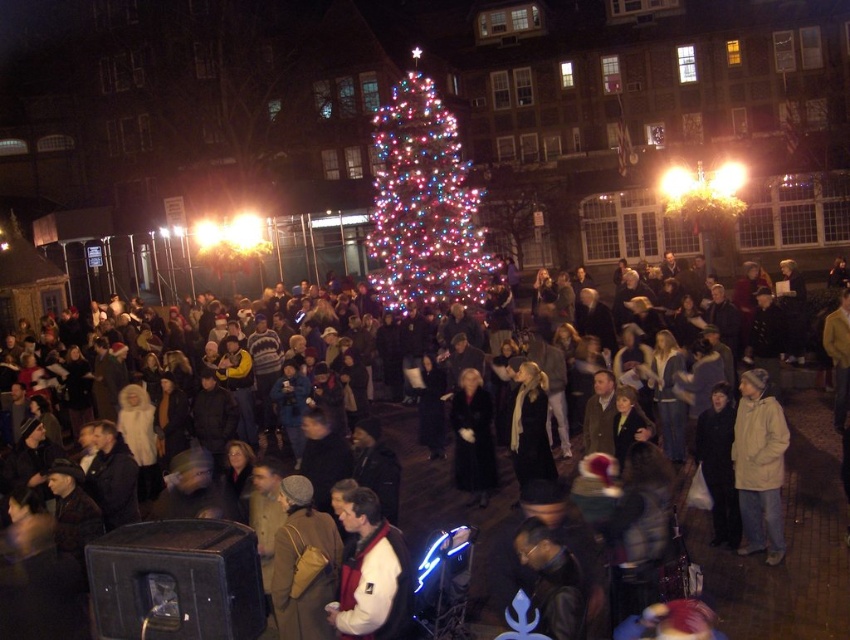
Question: Which point is farther to the camera?

Choices:
 (A) white fleece jacket at center
 (B) illuminated plastic christmas tree at center

Answer: (B)

Question: Which point is closer to the camera?

Choices:
 (A) (374, 284)
 (B) (347, 589)

Answer: (B)

Question: Which object is the closest to the white matte coat at center?

Choices:
 (A) illuminated plastic christmas tree at center
 (B) white fleece jacket at center

Answer: (B)

Question: Can you confirm if white fleece jacket at center is thinner than white matte coat at center?

Choices:
 (A) yes
 (B) no

Answer: (B)

Question: Observing the image, what is the correct spatial positioning of illuminated plastic christmas tree at center in reference to white fleece jacket at center?

Choices:
 (A) above
 (B) below

Answer: (A)

Question: Can you confirm if white fleece jacket at center is positioned below white matte coat at center?

Choices:
 (A) no
 (B) yes

Answer: (B)